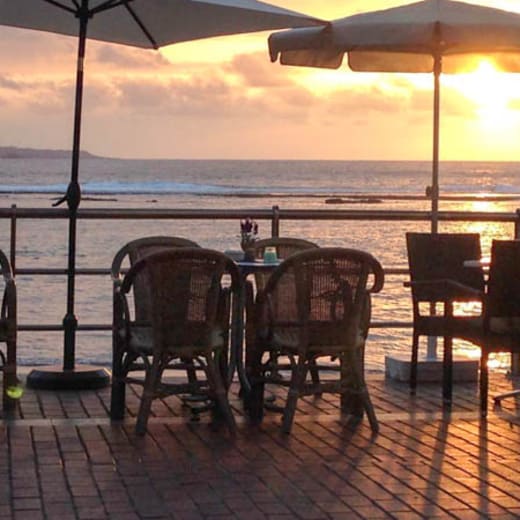
Find the location of a particular element. The width and height of the screenshot is (520, 520). small tables is located at coordinates (255, 267), (473, 263).